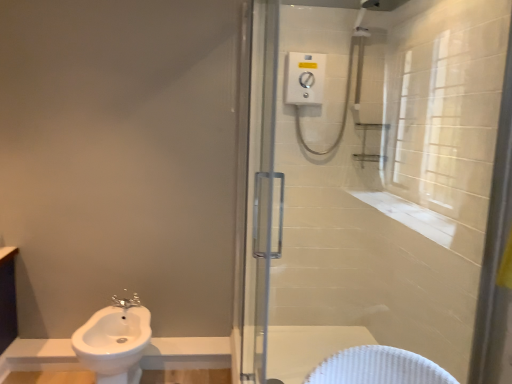
Question: From a real-world perspective, is satin nickel faucet at lower left on white glossy sink at lower left?

Choices:
 (A) no
 (B) yes

Answer: (B)

Question: Considering the relative sizes of satin nickel faucet at lower left and white glossy sink at lower left in the image provided, is satin nickel faucet at lower left wider than white glossy sink at lower left?

Choices:
 (A) yes
 (B) no

Answer: (B)

Question: Can you confirm if satin nickel faucet at lower left is shorter than white glossy sink at lower left?

Choices:
 (A) yes
 (B) no

Answer: (A)

Question: From a real-world perspective, is satin nickel faucet at lower left positioned under white glossy sink at lower left based on gravity?

Choices:
 (A) yes
 (B) no

Answer: (B)

Question: Does satin nickel faucet at lower left have a larger size compared to white glossy sink at lower left?

Choices:
 (A) no
 (B) yes

Answer: (A)

Question: Considering the relative positions of white glossy sink at lower left and satin nickel faucet at lower left in the image provided, is white glossy sink at lower left to the left or to the right of satin nickel faucet at lower left?

Choices:
 (A) left
 (B) right

Answer: (A)

Question: From a real-world perspective, is white glossy sink at lower left physically located above or below satin nickel faucet at lower left?

Choices:
 (A) above
 (B) below

Answer: (B)

Question: Relative to satin nickel faucet at lower left, is white glossy sink at lower left in front or behind?

Choices:
 (A) front
 (B) behind

Answer: (A)

Question: Is point (106, 370) positioned closer to the camera than point (123, 309)?

Choices:
 (A) farther
 (B) closer

Answer: (B)

Question: Looking at their shapes, would you say clear glass shower door at center is wider or thinner than satin nickel faucet at lower left?

Choices:
 (A) wide
 (B) thin

Answer: (B)

Question: Is clear glass shower door at center inside the boundaries of satin nickel faucet at lower left, or outside?

Choices:
 (A) inside
 (B) outside

Answer: (B)

Question: Is clear glass shower door at center in front of or behind satin nickel faucet at lower left in the image?

Choices:
 (A) front
 (B) behind

Answer: (A)

Question: From their relative heights in the image, would you say clear glass shower door at center is taller or shorter than satin nickel faucet at lower left?

Choices:
 (A) short
 (B) tall

Answer: (B)

Question: Would you say satin nickel faucet at lower left is to the left or to the right of white glossy sink at lower left in the picture?

Choices:
 (A) left
 (B) right

Answer: (B)

Question: In terms of width, does satin nickel faucet at lower left look wider or thinner when compared to white glossy sink at lower left?

Choices:
 (A) thin
 (B) wide

Answer: (A)